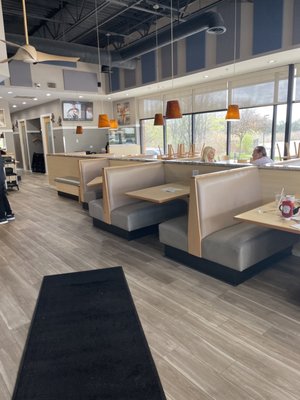
In order to click on clothes hangar in this screenshot , I will do `click(36, 141)`.